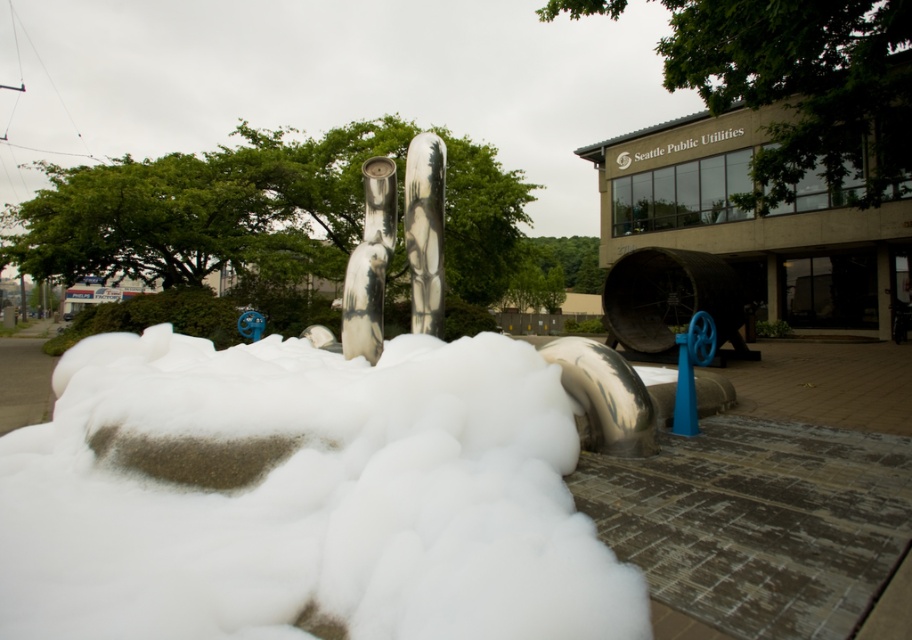
You are an inspector assessing the scene. You notice the shiny metallic pipe at center and the brushed metal sculpture at center. Which object would you need to step closer to in order to inspect its base?

The shiny metallic pipe at center is closer to the viewer than the brushed metal sculpture at center, so you would need to step closer to inspect the base of the brushed metal sculpture at center.

You are a maintenance worker tasked with cleaning the white foam on the ground. You have a 12 inch long cleaning tool. Can you reach the shiny metallic pipe at center from the brushed metal sculpture at center using your tool?

The shiny metallic pipe at center is 16.60 inches from the brushed metal sculpture at center. Since your tool is only 12 inches long, you cannot reach the shiny metallic pipe at center from the brushed metal sculpture at center with your current tool.

You are an inspector assessing the sculpture. You notice the shiny metallic pipe at center and the brushed metal sculpture at center. Which one has a greater height?

The brushed metal sculpture at center is taller than the shiny metallic pipe at center, so the brushed metal sculpture at center has a greater height.